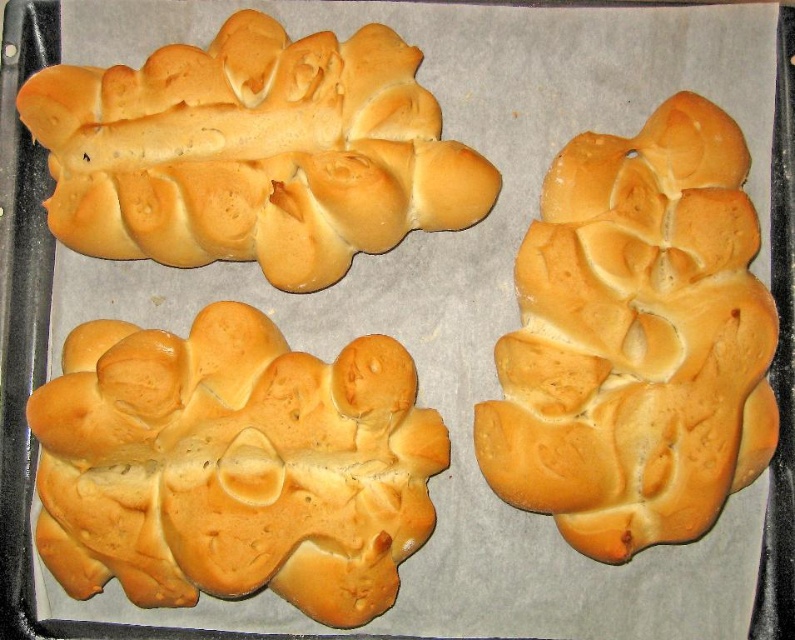
Question: Does golden-brown crusty loaf at center have a larger size compared to golden-brown crusty bread at center-right?

Choices:
 (A) no
 (B) yes

Answer: (A)

Question: Which point is closer to the camera taking this photo?

Choices:
 (A) (557, 296)
 (B) (119, 474)
 (C) (336, 211)

Answer: (A)

Question: Which object is the closest to the golden-brown crusty bread at center-right?

Choices:
 (A) golden-brown crusty loaf at center
 (B) golden-brown crusty bread at upper left

Answer: (A)

Question: Is golden-brown crusty loaf at center closer to the viewer compared to golden-brown crusty bread at upper left?

Choices:
 (A) yes
 (B) no

Answer: (A)

Question: Based on their relative distances, which object is farther from the golden-brown crusty loaf at center?

Choices:
 (A) golden-brown crusty bread at center-right
 (B) golden-brown crusty bread at upper left

Answer: (A)

Question: Can you confirm if golden-brown crusty loaf at center is positioned to the right of golden-brown crusty bread at upper left?

Choices:
 (A) no
 (B) yes

Answer: (A)